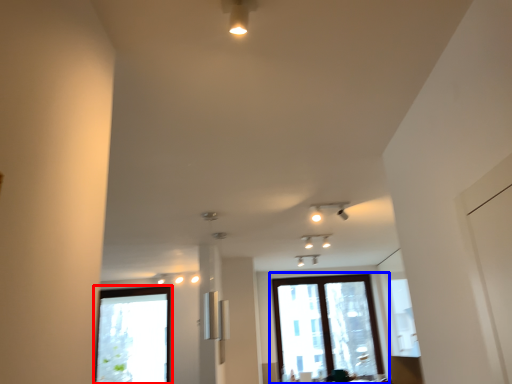
Question: Which object appears closest to the camera in this image, window (highlighted by a red box) or window (highlighted by a blue box)?

Choices:
 (A) window
 (B) window

Answer: (A)